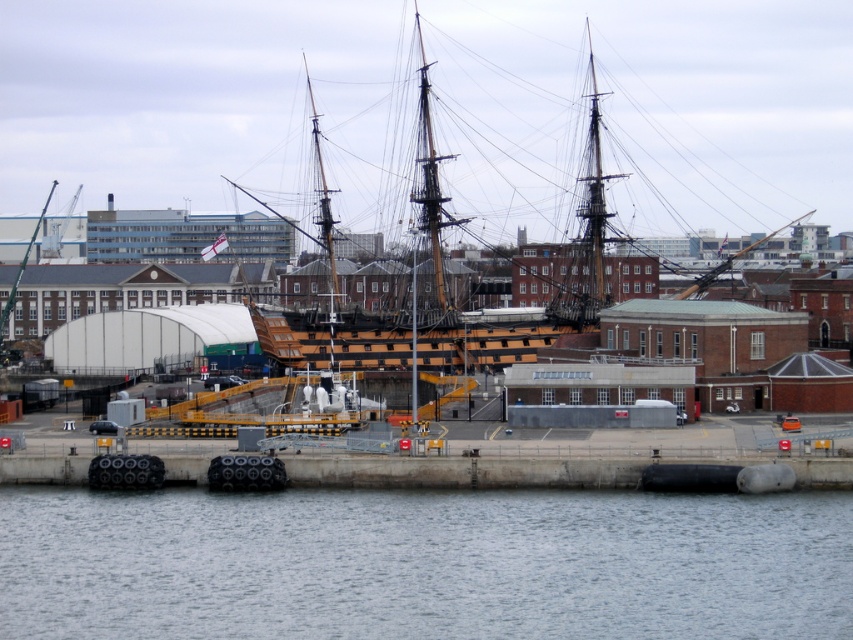
You are a tour guide explaining the ship to visitors. You mention the wooden ship at center and the clear water at lower center. Which one is wider?

The wooden ship at center is wider than the clear water at lower center.

You are standing on the dock and looking at the ship. There are two points marked on the ship, one at coordinates point (815, 628) and the other at point (42, 211). Which point is closer to your viewpoint?

→ Point (815, 628) is closer to the camera than point (42, 211), so the point at coordinates point (815, 628) is closer to your viewpoint.

You are a sailor standing on the deck of the ship and you see the clear water at lower center and the green matte mast at upper center. Which object is taller from your viewpoint?

The green matte mast at upper center is taller than the clear water at lower center.